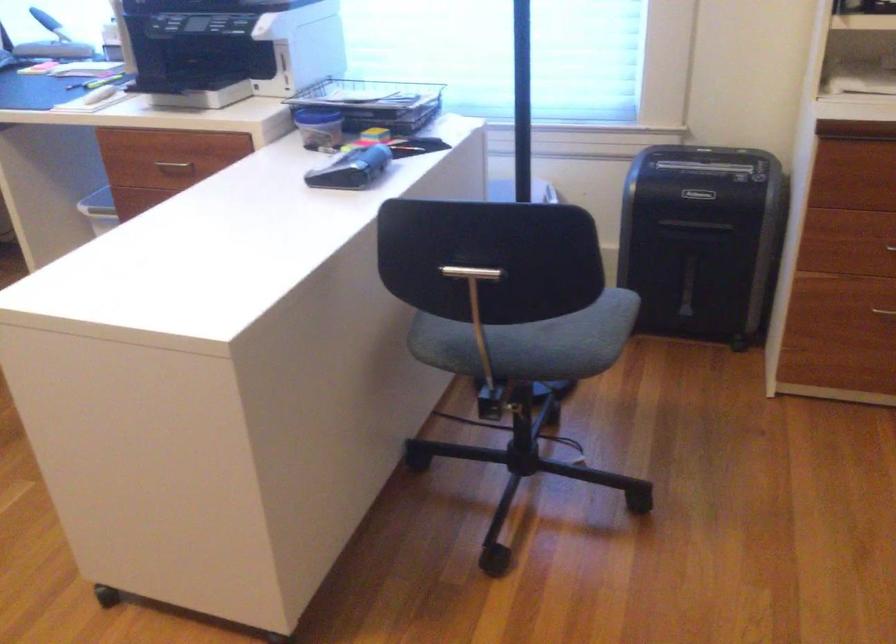
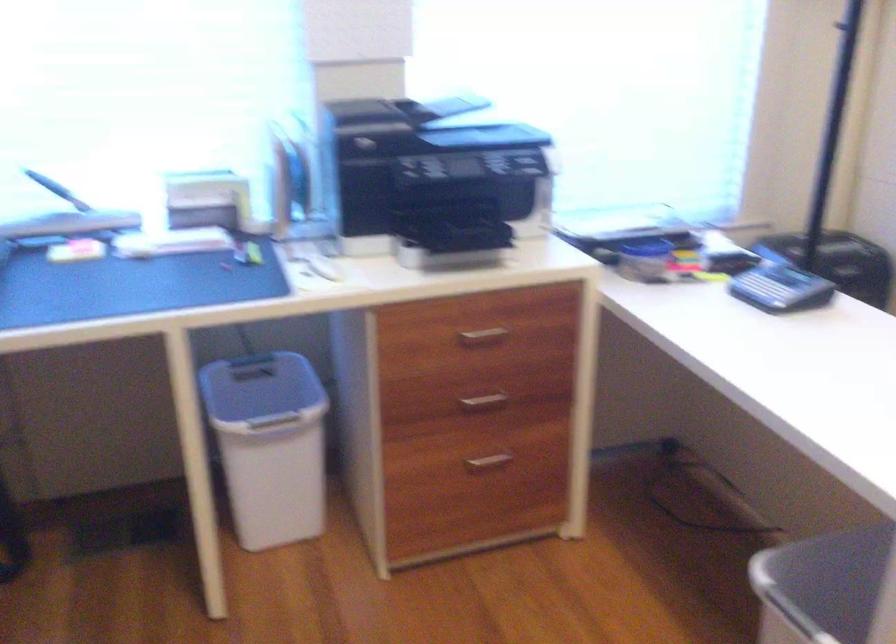
In the second image, find the point that corresponds to the point at 340,158 in the first image.

(780, 288)